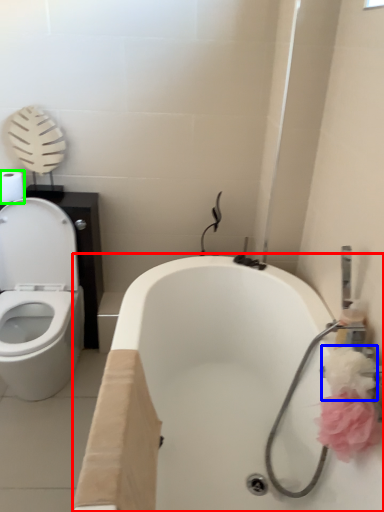
Question: Which object is the closest to the bath (highlighted by a red box)? Choose among these: flower (highlighted by a blue box) or toilet paper (highlighted by a green box).

Choices:
 (A) flower
 (B) toilet paper

Answer: (A)